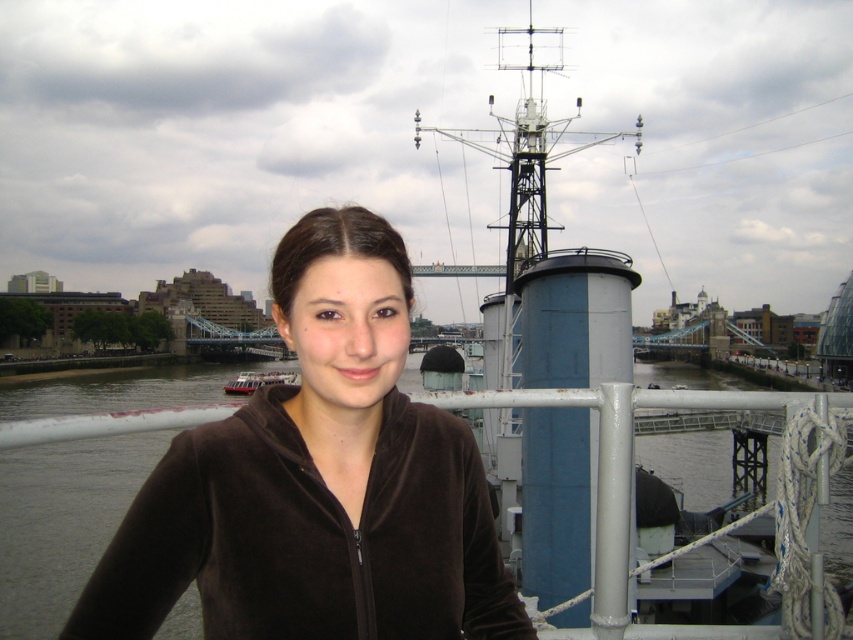
Between brown water at center and metallic silver boat at center, which one is positioned lower?

Positioned lower is brown water at center.

Is brown water at center further to the viewer compared to metallic silver boat at center?

That is False.

Between point (717, 468) and point (247, 388), which one is positioned behind?

Point (247, 388)

You are a GUI agent. You are given a task and a screenshot of the screen. Output one action in this format:
    pyautogui.click(x=<x>, y=<y>)
    Task: Click on the brown water at center
    
    Given the screenshot: What is the action you would take?
    coord(62,522)

Consider the image. Can you confirm if brown velvety jacket at center is positioned above brown water at center?

Yes, brown velvety jacket at center is above brown water at center.

Is brown velvety jacket at center positioned behind brown water at center?

No, it is not.

You are a GUI agent. You are given a task and a screenshot of the screen. Output one action in this format:
    pyautogui.click(x=<x>, y=<y>)
    Task: Click on the brown velvety jacket at center
    
    Given the screenshot: What is the action you would take?
    pyautogui.click(x=318, y=481)

Can you confirm if brown velvety jacket at center is bigger than metallic silver boat at center?

Actually, brown velvety jacket at center might be smaller than metallic silver boat at center.

This screenshot has height=640, width=853. What are the coordinates of `brown velvety jacket at center` in the screenshot? It's located at (318, 481).

Is point (247, 483) positioned before point (250, 380)?

Yes.

The image size is (853, 640). In order to click on brown velvety jacket at center in this screenshot , I will do `click(318, 481)`.